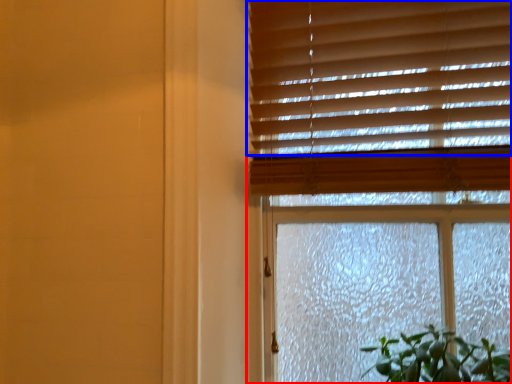
Question: Which of the following is the closest to the observer, window (highlighted by a red box) or blind (highlighted by a blue box)?

Choices:
 (A) window
 (B) blind

Answer: (A)